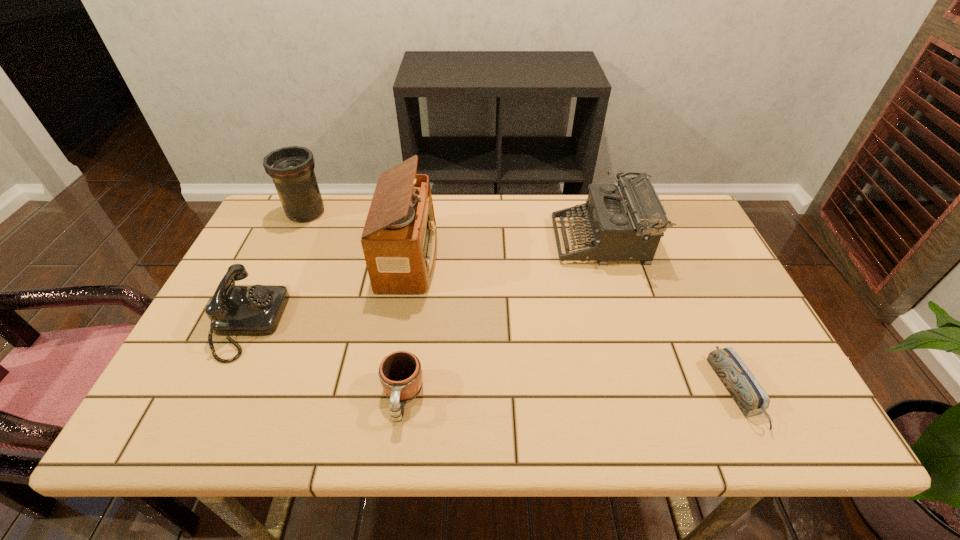
This screenshot has width=960, height=540. What are the coordinates of `free space that satisfies the following two spatial constraints: 1. on the typing side of the fifth object from left to right; 2. on the side of the fifth tallest object with the handle` in the screenshot? It's located at (649, 398).

Where is `vacant space that satisfies the following two spatial constraints: 1. on the front side of the telephoto lens; 2. on the dial of the telephone`? The image size is (960, 540). vacant space that satisfies the following two spatial constraints: 1. on the front side of the telephoto lens; 2. on the dial of the telephone is located at coordinates (254, 324).

Locate an element on the screen. Image resolution: width=960 pixels, height=540 pixels. free space that satisfies the following two spatial constraints: 1. on the front panel of the radio receiver; 2. on the left side of the pencil box is located at coordinates (387, 392).

You are a GUI agent. You are given a task and a screenshot of the screen. Output one action in this format:
    pyautogui.click(x=<x>, y=<y>)
    Task: Click on the vacant area in the image that satisfies the following two spatial constraints: 1. on the back side of the rightmost object; 2. on the typing side of the typewriter
    The image size is (960, 540).
    Given the screenshot: What is the action you would take?
    pyautogui.click(x=666, y=241)

Image resolution: width=960 pixels, height=540 pixels. I want to click on free location that satisfies the following two spatial constraints: 1. on the front side of the telephoto lens; 2. on the dial of the fourth tallest object, so click(x=254, y=324).